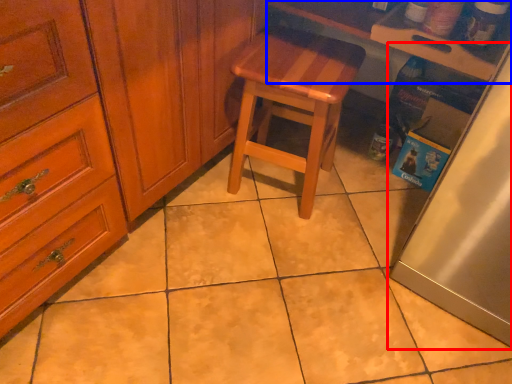
Question: Among these objects, which one is farthest to the camera, fridge (highlighted by a red box) or counter top (highlighted by a blue box)?

Choices:
 (A) fridge
 (B) counter top

Answer: (B)